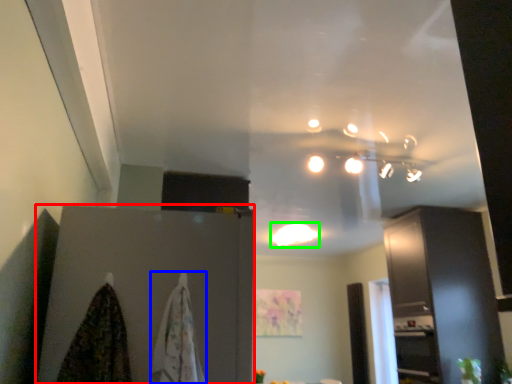
Question: Based on their relative distances, which object is farther from cabinetry (highlighted by a red box)? Choose from blanket (highlighted by a blue box) and lighting (highlighted by a green box).

Choices:
 (A) blanket
 (B) lighting

Answer: (B)